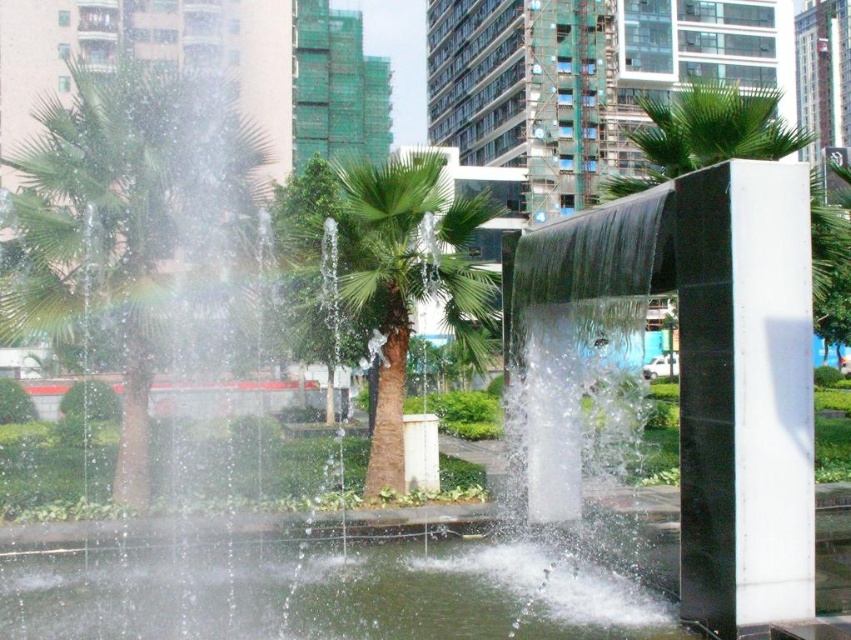
You are a city planner assessing the urban space. You need to determine if the black polished stone pillar at right can be moved to make more space for pedestrians around the clear water at center. Based on their sizes, is this feasible?

The black polished stone pillar at right occupies less space than clear water at center, so moving it would free up space, making more room for pedestrians around the clear water at center.

You are a maintenance worker inspecting the urban fountain area. You need to locate the black polished stone pillar at right and the clear water at center. From the perspective of someone standing facing the fountain, which object is positioned to the right side?

The black polished stone pillar at right is to the right of clear water at center, so from the perspective of someone facing the fountain, the black polished stone pillar at right is positioned to the right side.

You are standing in the urban park and want to take a photo of the black polished stone pillar at right and the green leafy palm tree at left. Which object should you position to your left side to include both in the frame?

To include both the black polished stone pillar at right and the green leafy palm tree at left in your photo, position the green leafy palm tree at left to your left side since it is located to the left of the black polished stone pillar at right.